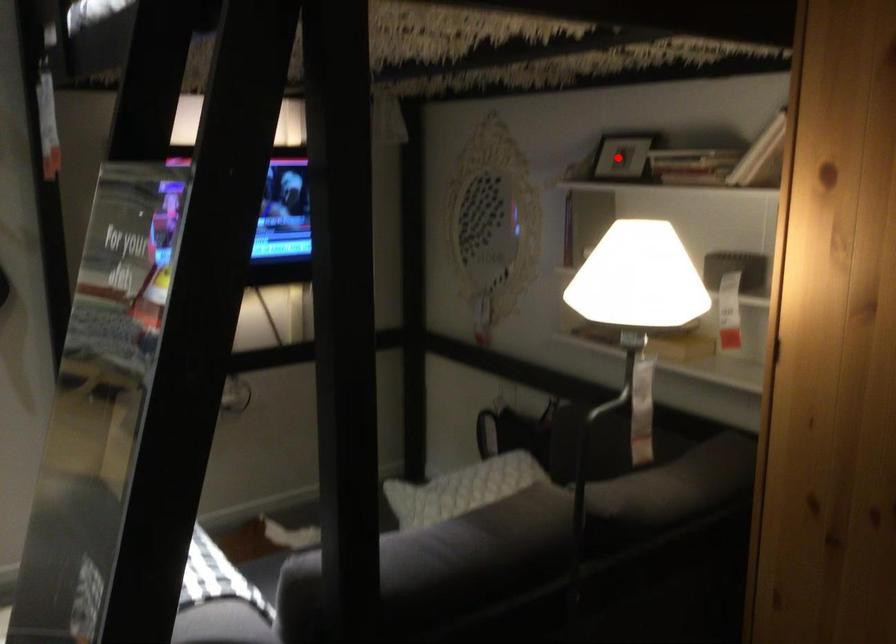
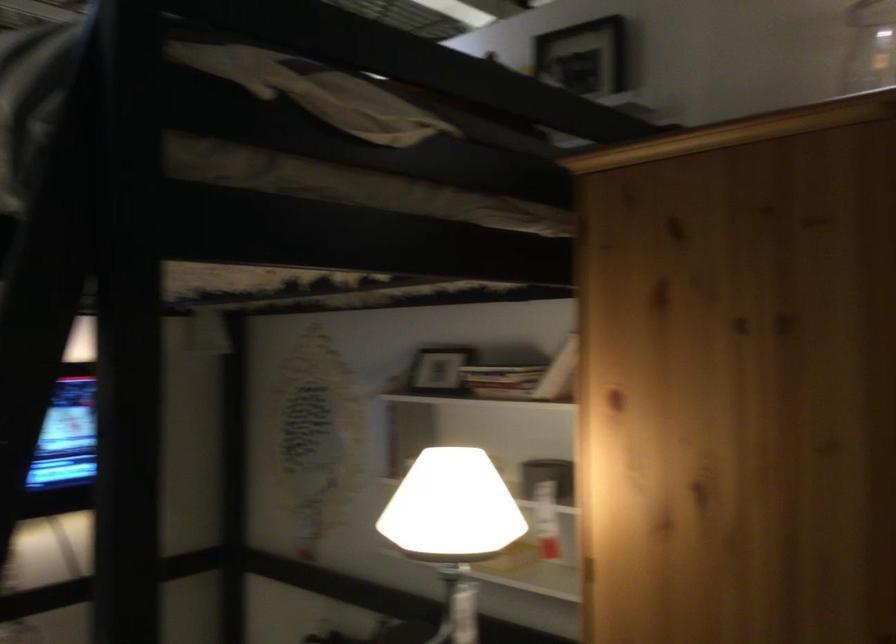
In the second image, find the point that corresponds to the highlighted location in the first image.

(435, 372)